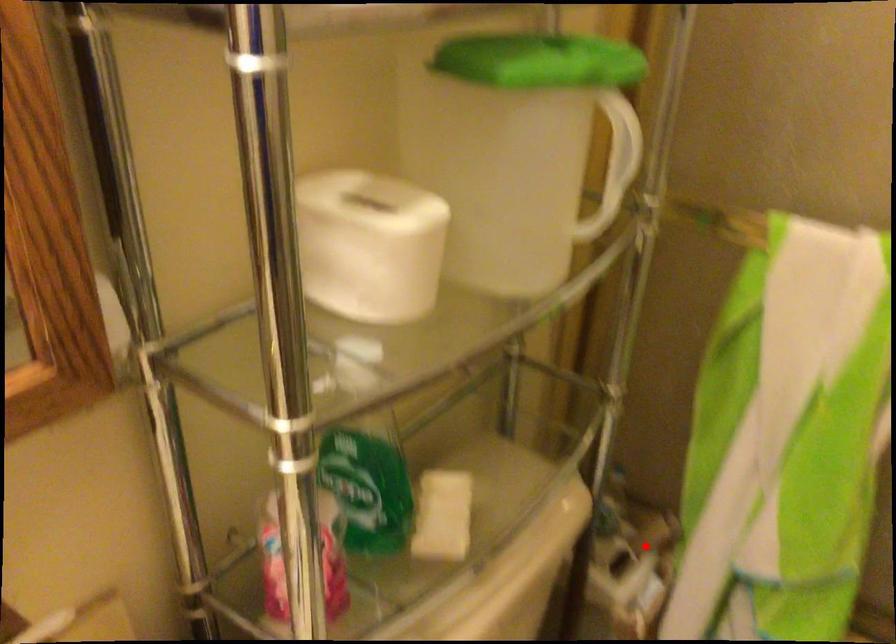
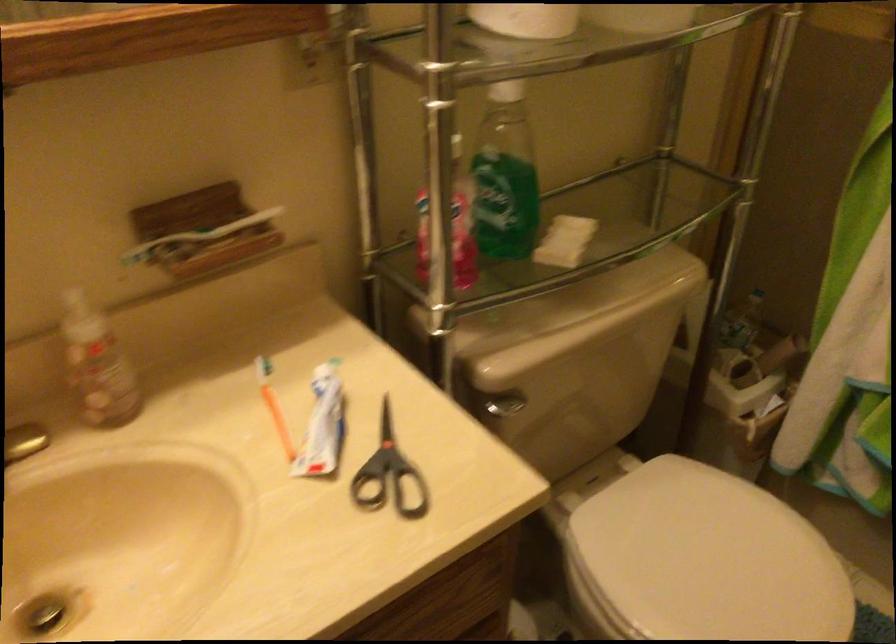
In the second image, find the point that corresponds to the highlighted location in the first image.

(764, 361)